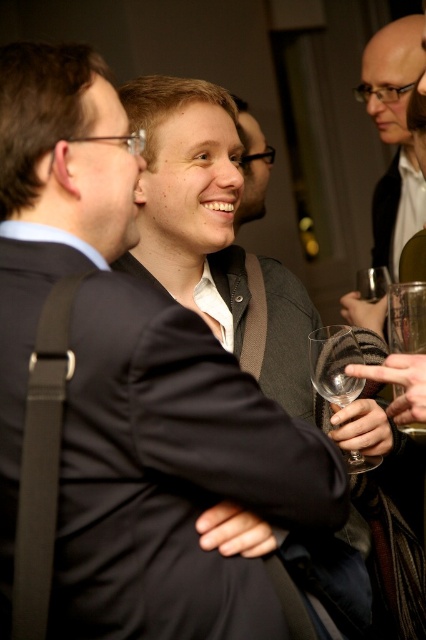
Who is lower down, matte black suit at upper right or transparent glass wine glass at center?

Positioned lower is transparent glass wine glass at center.

Who is taller, matte black suit at upper right or transparent glass wine glass at center?

With more height is matte black suit at upper right.

The image size is (426, 640). I want to click on matte black suit at upper right, so coord(393,120).

How much distance is there between matte black suit at upper right and matte black sweater at center?

matte black suit at upper right is 21.89 inches away from matte black sweater at center.

The height and width of the screenshot is (640, 426). I want to click on matte black suit at upper right, so click(393, 120).

Which is more to the right, transparent glass wine glass at center or matte black sweater at center?

Positioned to the right is transparent glass wine glass at center.

Does point (345, 397) come closer to viewer compared to point (235, 100)?

Yes, it is.

This screenshot has width=426, height=640. Describe the element at coordinates (334, 364) in the screenshot. I see `transparent glass wine glass at center` at that location.

Identify the location of transparent glass wine glass at center. (334, 364).